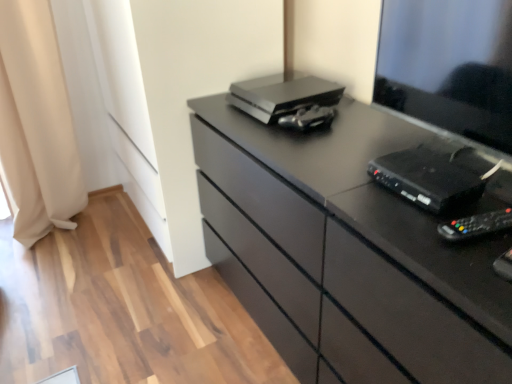
I want to click on empty space that is to the right of beige fabric curtain at left, so click(x=122, y=235).